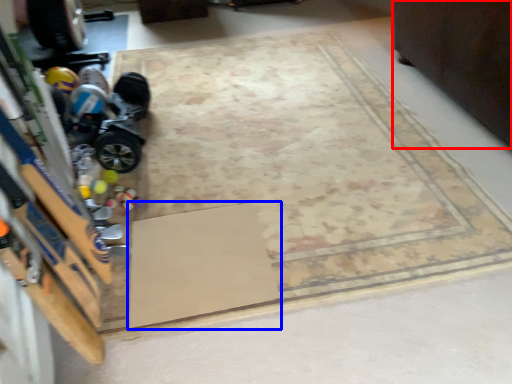
Question: Which object is closer to the camera taking this photo, furniture (highlighted by a red box) or doormat (highlighted by a blue box)?

Choices:
 (A) furniture
 (B) doormat

Answer: (B)